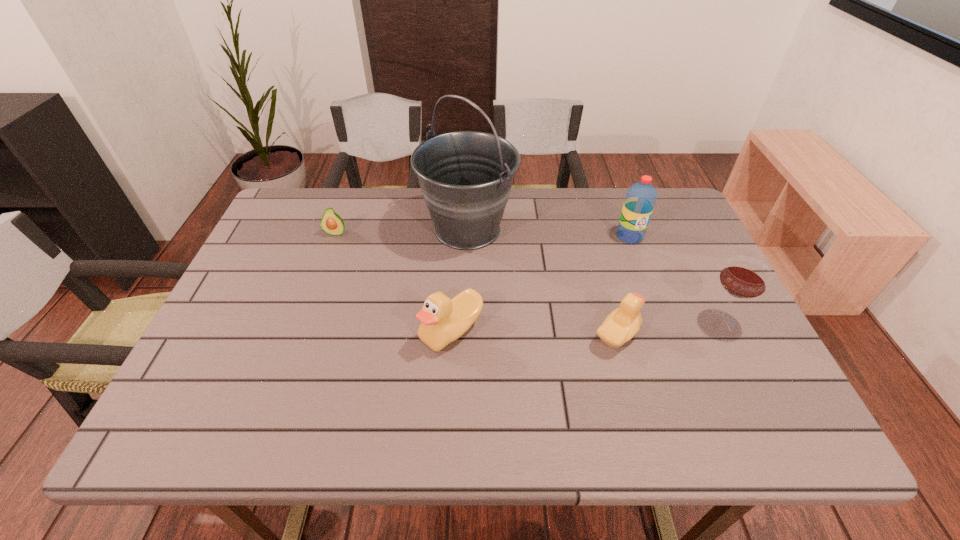
Where is `empty space between the rightmost object and the leftmost object`? empty space between the rightmost object and the leftmost object is located at coordinates (528, 276).

The height and width of the screenshot is (540, 960). I want to click on free space between the wineglass and the shorter duck, so click(x=668, y=328).

Image resolution: width=960 pixels, height=540 pixels. Find the location of `free space between the water bottle and the tallest object`. free space between the water bottle and the tallest object is located at coordinates (548, 233).

Identify the location of vacant area that lies between the fourth shortest object and the second tallest object. This screenshot has height=540, width=960. (675, 278).

Image resolution: width=960 pixels, height=540 pixels. What are the coordinates of `free spot between the fourth object from left to right and the left duck` in the screenshot? It's located at tap(534, 333).

You are a GUI agent. You are given a task and a screenshot of the screen. Output one action in this format:
    pyautogui.click(x=<x>, y=<y>)
    Task: Click on the free space between the tallest object and the left duck
    This screenshot has height=540, width=960.
    Given the screenshot: What is the action you would take?
    pyautogui.click(x=460, y=280)

Where is `vacant space that is in between the avocado and the taller duck`? Image resolution: width=960 pixels, height=540 pixels. vacant space that is in between the avocado and the taller duck is located at coordinates (394, 282).

At what (x,y) coordinates should I click in order to perform the action: click on free space between the third tallest object and the bucket. Please return your answer as a coordinate pair (x, y). The image size is (960, 540). Looking at the image, I should click on (593, 274).

Locate an element on the screen. This screenshot has width=960, height=540. object that can be found as the second closest to the third tallest object is located at coordinates (641, 197).

Find the location of a particular element. object that is the third closest to the shorter duck is located at coordinates (443, 320).